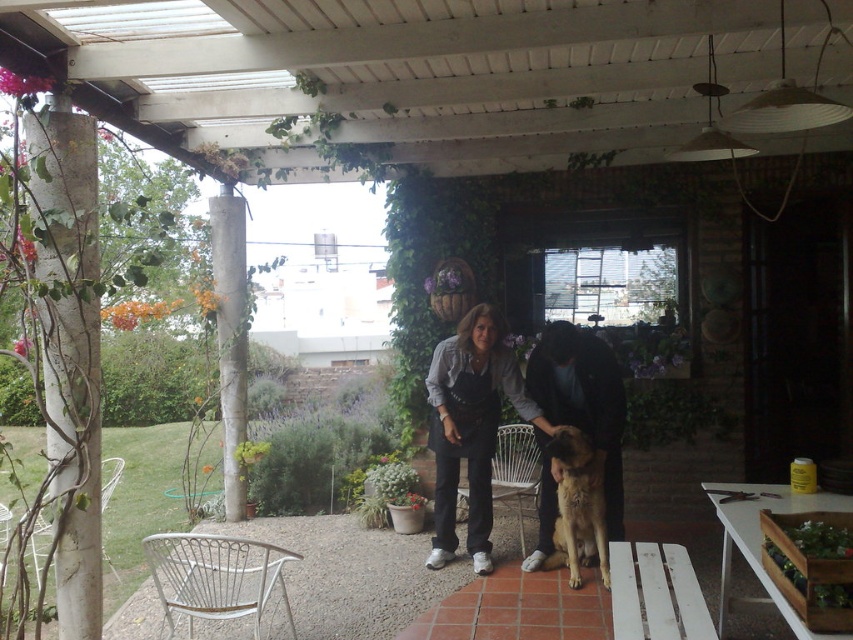
Which of these two, dark gray denim jacket at center or golden fur dog at center, stands taller?

Standing taller between the two is dark gray denim jacket at center.

Between dark gray denim jacket at center and golden fur dog at center, which one is positioned higher?

dark gray denim jacket at center

Find the location of `dark gray denim jacket at center`. dark gray denim jacket at center is located at coordinates (520, 417).

Is dark gray denim jacket at center to the right of dark brown fur at center from the viewer's perspective?

No, dark gray denim jacket at center is not to the right of dark brown fur at center.

Which is in front, point (445, 449) or point (605, 496)?

Positioned in front is point (605, 496).

Find the location of `dark gray denim jacket at center`. dark gray denim jacket at center is located at coordinates (520, 417).

Who is positioned more to the left, dark brown fur at center or golden fur dog at center?

golden fur dog at center

Between point (604, 508) and point (554, 531), which one is positioned behind?

The point (554, 531) is behind.

Which is behind, point (541, 394) or point (585, 448)?

Point (541, 394)

Where is `dark brown fur at center`? The width and height of the screenshot is (853, 640). dark brown fur at center is located at coordinates (583, 403).